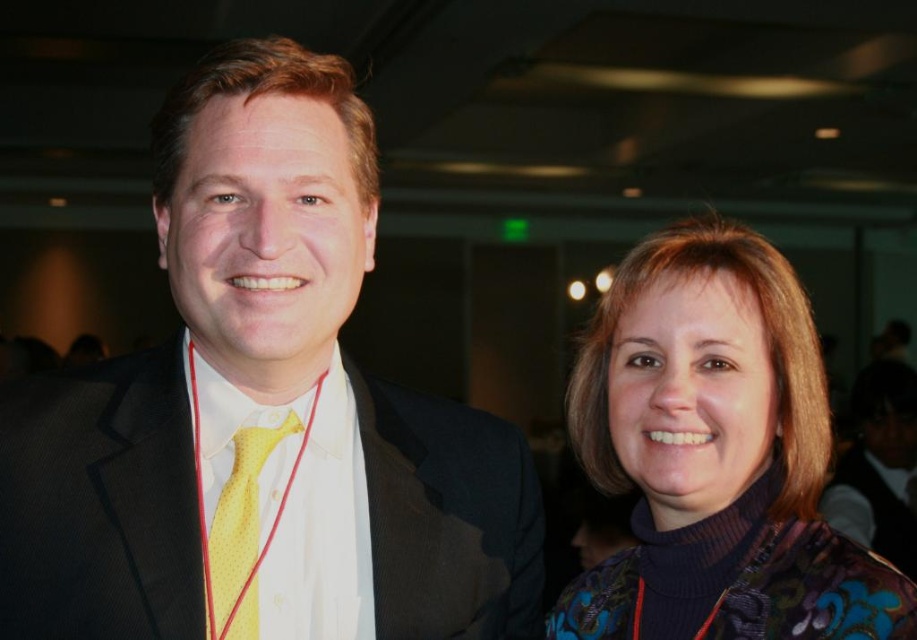
You are a photographer adjusting the camera focus. The camera can only focus on objects within a 10 inch range. You need to capture both the matte black suit at left and the multicolored floral sweater at right in sharp focus. Is this possible?

The matte black suit at left and multicolored floral sweater at right are 11.45 inches apart from each other. Since the camera can only focus within a 10 inch range, capturing both in sharp focus would not be possible as the distance exceeds the focus range.

You are organizing a photo shoot and need to ensure that all accessories are visible in the frame. Given the multicolored floral sweater at right and the yellow dotted tie at center, which one would require more space in the photo to be fully visible?

The multicolored floral sweater at right has a larger size compared to the yellow dotted tie at center, so it would require more space in the photo to be fully visible.

You are standing in the conference room and need to find the matte black suit at left. According to the coordinates provided, where should you look to locate it?

The matte black suit at left is located at point coordinates 0.648 on the x axis and 0.286 on the y axis.